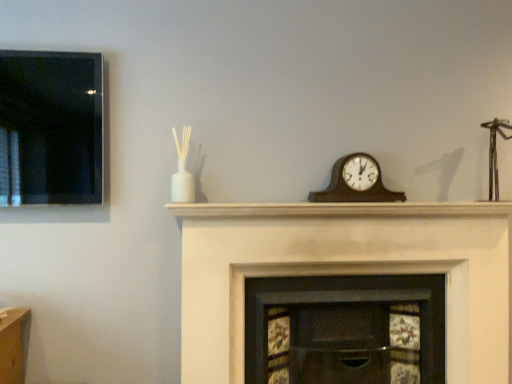
Question: Can you confirm if white matte mantle at center is shorter than wooden clock at center?

Choices:
 (A) yes
 (B) no

Answer: (A)

Question: Is white matte mantle at center beside wooden clock at center?

Choices:
 (A) no
 (B) yes

Answer: (A)

Question: Is white matte mantle at center at the left side of wooden clock at center?

Choices:
 (A) yes
 (B) no

Answer: (A)

Question: Is white matte mantle at center in front of wooden clock at center?

Choices:
 (A) no
 (B) yes

Answer: (B)

Question: Does white matte mantle at center have a smaller size compared to wooden clock at center?

Choices:
 (A) no
 (B) yes

Answer: (A)

Question: Is white matte mantle at center aimed at wooden clock at center?

Choices:
 (A) yes
 (B) no

Answer: (B)

Question: Can white painted wood fireplace at center, positioned as the 1th fireplace in right-to-left order, be found inside wooden clock at center?

Choices:
 (A) no
 (B) yes

Answer: (A)

Question: Can you confirm if wooden clock at center is positioned to the left of white painted wood fireplace at center, the 2th fireplace from the left?

Choices:
 (A) no
 (B) yes

Answer: (A)

Question: From a real-world perspective, is wooden clock at center physically below white painted wood fireplace at center, the 2th fireplace from the left?

Choices:
 (A) yes
 (B) no

Answer: (B)

Question: From the image's perspective, is wooden clock at center over white painted wood fireplace at center, the 2th fireplace from the left?

Choices:
 (A) no
 (B) yes

Answer: (B)

Question: Is the position of wooden clock at center less distant than that of white painted wood fireplace at center, positioned as the 1th fireplace in right-to-left order?

Choices:
 (A) yes
 (B) no

Answer: (B)

Question: From the image's perspective, is wooden clock at center beneath white painted wood fireplace at center, positioned as the 1th fireplace in right-to-left order?

Choices:
 (A) no
 (B) yes

Answer: (A)

Question: From the image's perspective, does wooden clock at center appear higher than white matte mantle at center?

Choices:
 (A) yes
 (B) no

Answer: (A)